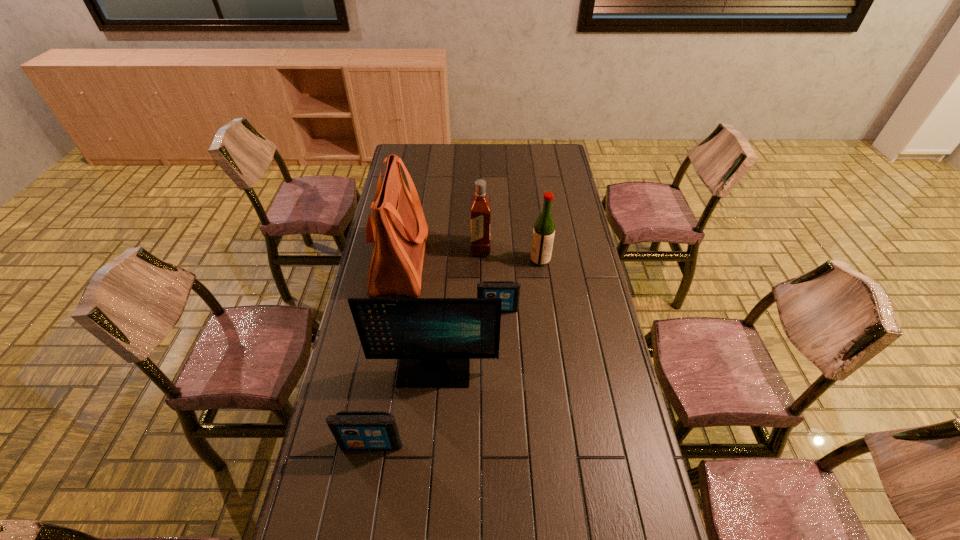
Identify the location of free region located on the label of the rightmost object. This screenshot has width=960, height=540. (440, 260).

Where is `vacant space located 0.320m on the label of the rightmost object`? The width and height of the screenshot is (960, 540). vacant space located 0.320m on the label of the rightmost object is located at coordinates (452, 260).

At what (x,y) coordinates should I click in order to perform the action: click on vacant space located on the label of the rightmost object. Please return your answer as a coordinate pair (x, y). This screenshot has height=540, width=960. Looking at the image, I should click on (481, 260).

This screenshot has height=540, width=960. What are the coordinates of `vacant space situated on the front label of the left liquor` in the screenshot? It's located at (409, 248).

Where is `blank space located on the front label of the left liquor`? Image resolution: width=960 pixels, height=540 pixels. blank space located on the front label of the left liquor is located at coordinates (380, 248).

The height and width of the screenshot is (540, 960). I want to click on vacant space located 0.120m on the front label of the left liquor, so click(443, 248).

Image resolution: width=960 pixels, height=540 pixels. What are the coordinates of `vacant point located on the front pocket of the shopping bag` in the screenshot? It's located at (500, 261).

Where is `free space located 0.160m on the screen side of the monitor`? The height and width of the screenshot is (540, 960). free space located 0.160m on the screen side of the monitor is located at coordinates (428, 437).

Where is `iPod at the left edge`? The image size is (960, 540). iPod at the left edge is located at coordinates (353, 430).

Where is `shopping bag that is positioned at the left edge`? shopping bag that is positioned at the left edge is located at coordinates (398, 228).